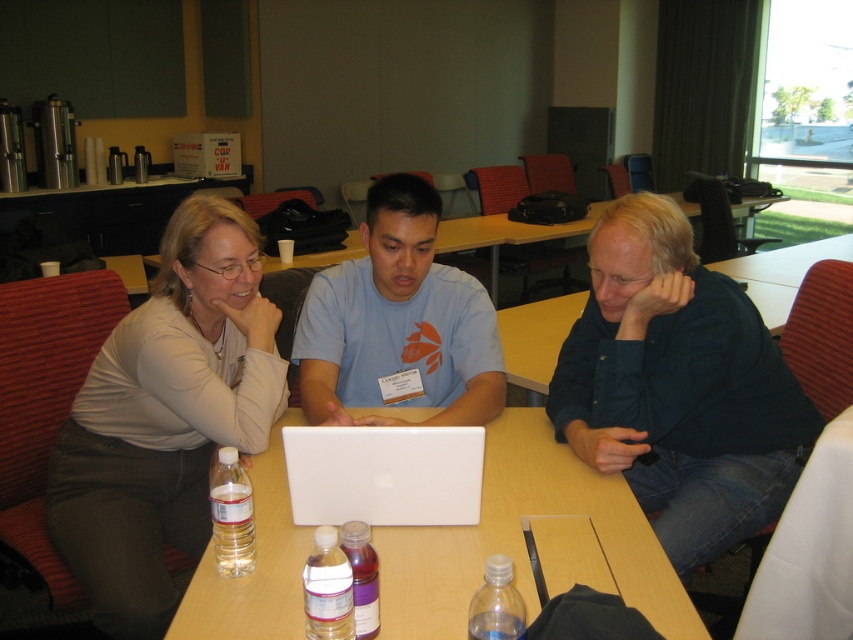
Question: Among these objects, which one is farthest from the camera?

Choices:
 (A) white matte laptop at center
 (B) matte beige sweater at center

Answer: (B)

Question: Is dark blue shirt at center bigger than white plastic table at center?

Choices:
 (A) yes
 (B) no

Answer: (A)

Question: From the image, what is the correct spatial relationship of dark blue shirt at center in relation to light blue t-shirt at center?

Choices:
 (A) below
 (B) above

Answer: (A)

Question: Which point is closer to the camera taking this photo?

Choices:
 (A) click(468, 448)
 (B) click(125, 506)
 (C) click(329, 337)

Answer: (A)

Question: Is light blue t-shirt at center bigger than white matte laptop at center?

Choices:
 (A) yes
 (B) no

Answer: (A)

Question: Which of the following is the closest to the observer?

Choices:
 (A) white plastic table at center
 (B) light blue t-shirt at center

Answer: (A)